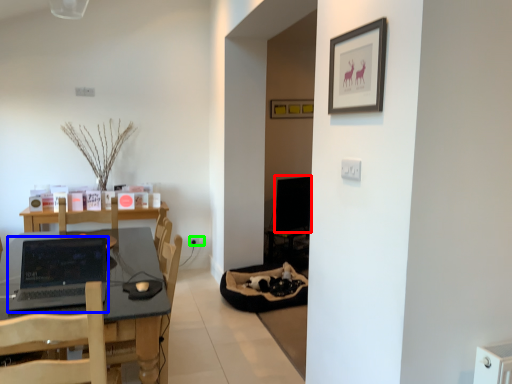
Question: Which is farther away from computer monitor (highlighted by a red box)? laptop (highlighted by a blue box) or electric outlet (highlighted by a green box)?

Choices:
 (A) laptop
 (B) electric outlet

Answer: (A)